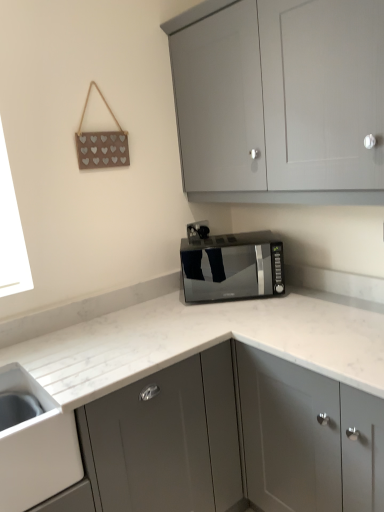
Question: Can you confirm if satin black microwave at center is bigger than black plastic electric outlet at center?

Choices:
 (A) yes
 (B) no

Answer: (A)

Question: Is satin black microwave at center facing towards black plastic electric outlet at center?

Choices:
 (A) yes
 (B) no

Answer: (B)

Question: Does satin black microwave at center lie behind black plastic electric outlet at center?

Choices:
 (A) no
 (B) yes

Answer: (A)

Question: Can you confirm if satin black microwave at center is wider than black plastic electric outlet at center?

Choices:
 (A) no
 (B) yes

Answer: (B)

Question: Can you confirm if satin black microwave at center is positioned to the right of black plastic electric outlet at center?

Choices:
 (A) yes
 (B) no

Answer: (A)

Question: Is satin black microwave at center closer to the viewer compared to black plastic electric outlet at center?

Choices:
 (A) yes
 (B) no

Answer: (A)

Question: Does white glossy sink at lower left appear on the right side of satin grey cabinet at center, which ranks as the second cabinetry in top-to-bottom order?

Choices:
 (A) no
 (B) yes

Answer: (A)

Question: From the image's perspective, is white glossy sink at lower left beneath satin grey cabinet at center, arranged as the 1th cabinetry when ordered from the bottom?

Choices:
 (A) no
 (B) yes

Answer: (A)

Question: Is white glossy sink at lower left far away from satin grey cabinet at center, arranged as the 1th cabinetry when ordered from the bottom?

Choices:
 (A) no
 (B) yes

Answer: (A)

Question: Does white glossy sink at lower left have a larger size compared to satin grey cabinet at center, arranged as the 1th cabinetry when ordered from the bottom?

Choices:
 (A) yes
 (B) no

Answer: (B)

Question: From a real-world perspective, is white glossy sink at lower left physically above satin grey cabinet at center, arranged as the 1th cabinetry when ordered from the bottom?

Choices:
 (A) no
 (B) yes

Answer: (B)

Question: From the image's perspective, would you say white glossy sink at lower left is positioned over satin grey cabinet at center, which ranks as the second cabinetry in top-to-bottom order?

Choices:
 (A) no
 (B) yes

Answer: (B)

Question: Is satin black microwave at center behind matte gray cabinet at upper center, the second cabinetry when ordered from bottom to top?

Choices:
 (A) no
 (B) yes

Answer: (B)